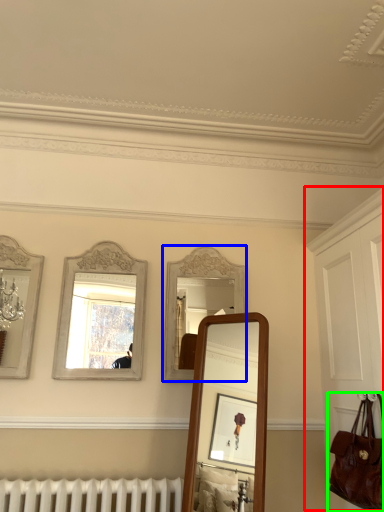
Question: Estimate the real-world distances between objects in this image. Which object is farther from dresser (highlighted by a red box), mirror (highlighted by a blue box) or handbag (highlighted by a green box)?

Choices:
 (A) mirror
 (B) handbag

Answer: (A)